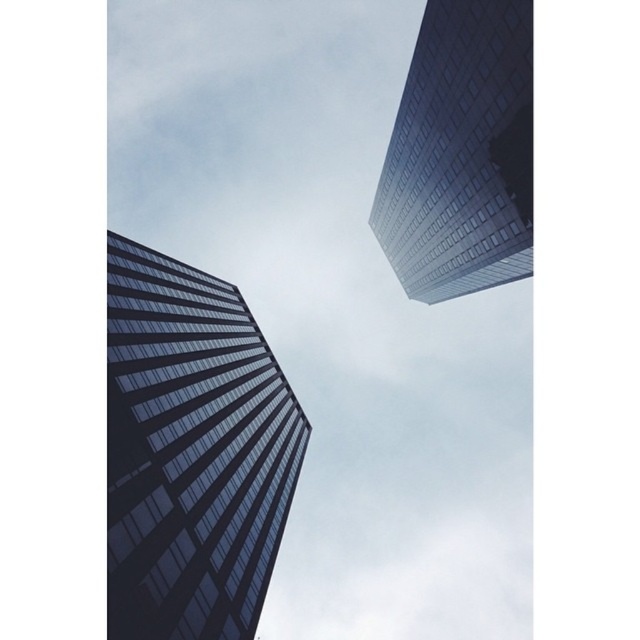
Does glassy reflective skyscraper at center appear on the right side of glassy reflective skyscraper at upper right?

Incorrect, glassy reflective skyscraper at center is not on the right side of glassy reflective skyscraper at upper right.

Is point (268, 483) more distant than point (504, 29)?

Yes, point (268, 483) is behind point (504, 29).

At what (x,y) coordinates should I click in order to perform the action: click on glassy reflective skyscraper at center. Please return your answer as a coordinate pair (x, y). This screenshot has width=640, height=640. Looking at the image, I should click on (192, 451).